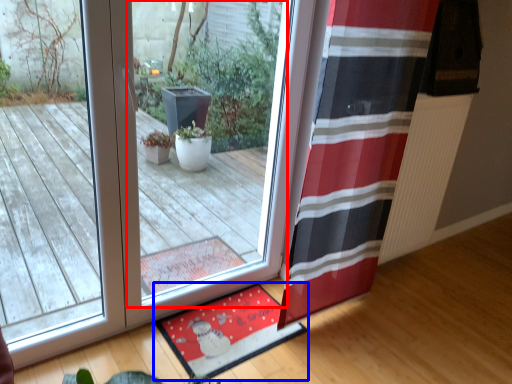
Question: Which object appears closest to the camera in this image, window (highlighted by a red box) or mat (highlighted by a blue box)?

Choices:
 (A) window
 (B) mat

Answer: (A)